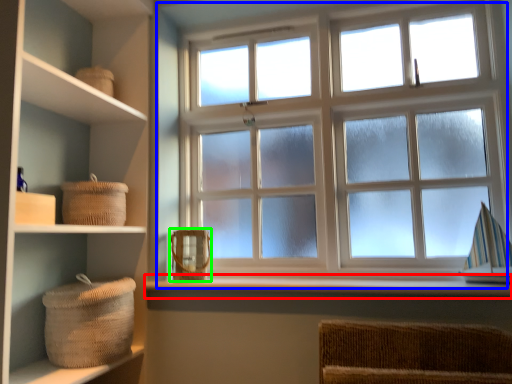
Question: Considering the real-world distances, which object is farthest from window sill (highlighted by a red box)? window (highlighted by a blue box) or basket (highlighted by a green box)?

Choices:
 (A) window
 (B) basket

Answer: (A)